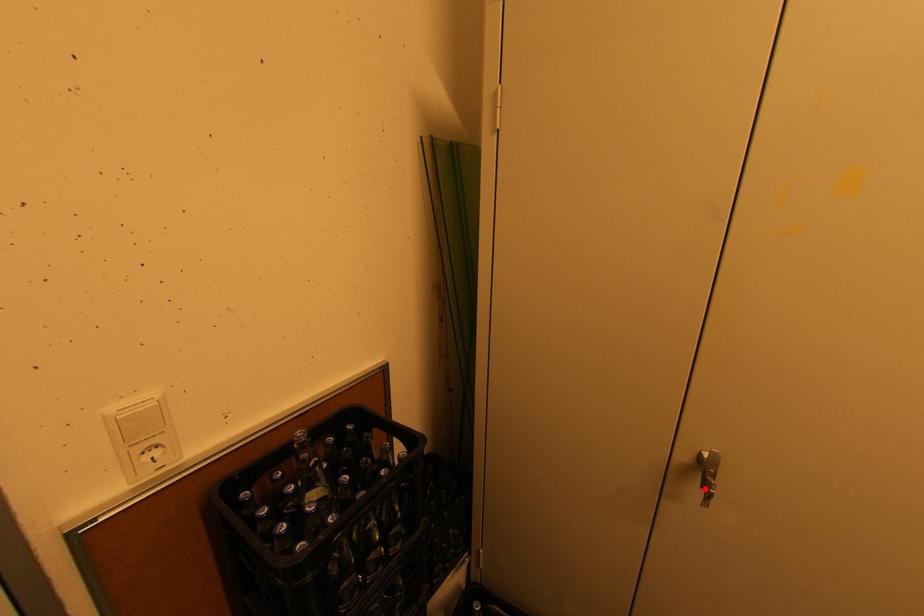
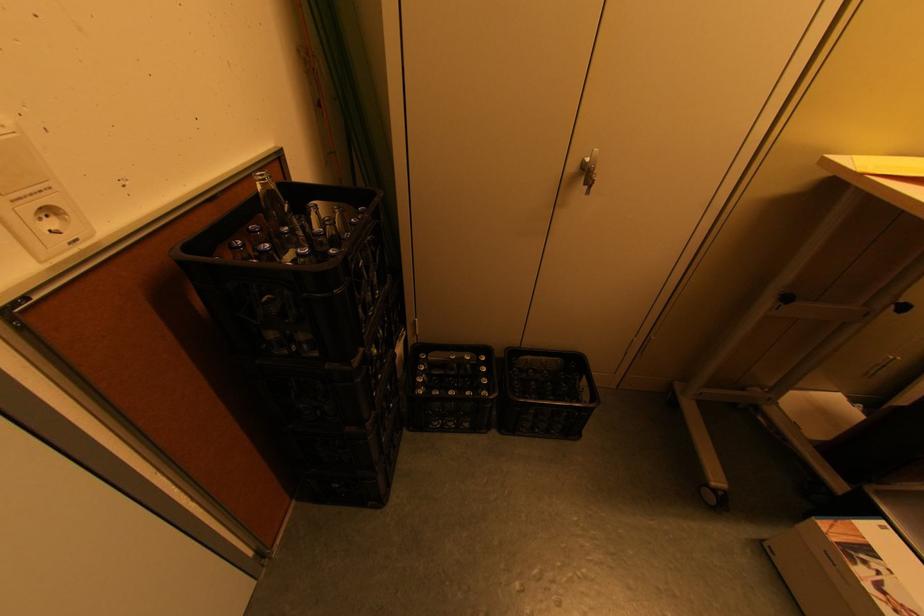
Question: I am providing you with two images of the same scene from different viewpoints. A red point is marked on the first image. Can you still see the location of the red point in image 2?

Choices:
 (A) Yes
 (B) No

Answer: (A)